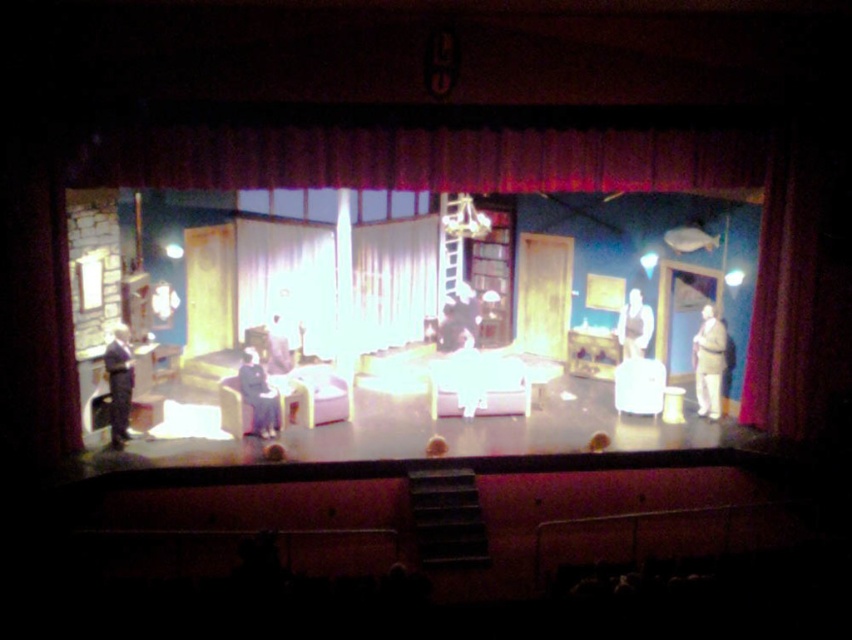
You are an actor preparing to exit the stage through the doorway on the right. You need to pass by the white cotton shirt at right and the white fabric curtain at center. Which object will you encounter first as you move towards the exit?

The white cotton shirt at right is closer to the doorway, so you will encounter the white cotton shirt at right first before reaching the white fabric curtain at center.

You are an audience member sitting in the front row of the theater. You notice a white fabric curtain at center. Can you estimate its position on the stage using coordinates? Please provide the coordinates as a point in the format of x,y.

The white fabric curtain at center is located at coordinates (288, 280).